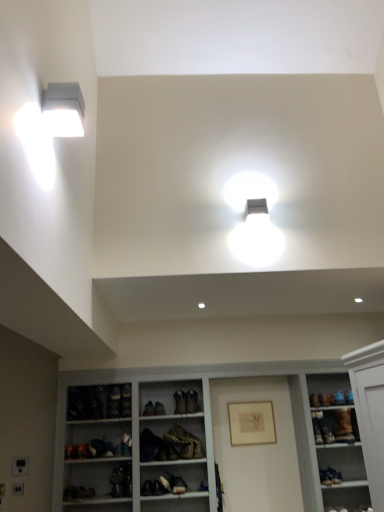
What do you see at coordinates (180, 402) in the screenshot? This screenshot has width=384, height=512. I see `matte black shoe at center, the third shoe viewed from the right` at bounding box center [180, 402].

Locate an element on the screen. leather jacket at center is located at coordinates (169, 445).

Find the location of `matte brown picture frame at center`. matte brown picture frame at center is located at coordinates (251, 423).

At what (x,y) coordinates should I click in order to perform the action: click on white matte exhaust hood at upper left. Please return your answer as a coordinate pair (x, y). Looking at the image, I should click on (42, 311).

This screenshot has height=512, width=384. What are the coordinates of `matte black shoe at center, which appears as the 2th shoe when viewed from the left` in the screenshot? It's located at (192, 402).

The height and width of the screenshot is (512, 384). Describe the element at coordinates (64, 109) in the screenshot. I see `white matte rectangular light fixture at upper left` at that location.

In order to face white matte rectangular light fixture at upper left, should I rotate leftwards or rightwards?

To align with it, rotate left about 16.422°.

Locate an element on the screen. This screenshot has width=384, height=512. matte black shoe at center, the third shoe viewed from the right is located at coordinates (180, 402).

Are matte black shoe at center, positioned as the second shoe in right-to-left order, and white wood shelves at center located far from each other?

No, there isn't a large distance between matte black shoe at center, positioned as the second shoe in right-to-left order, and white wood shelves at center.

Is matte black shoe at center, which appears as the 2th shoe when viewed from the left, at the right side of white wood shelves at center?

No.

Is white wood shelves at center a part of matte black shoe at center, positioned as the second shoe in right-to-left order?

No, white wood shelves at center is not a part of matte black shoe at center, positioned as the second shoe in right-to-left order.

Which object is more forward, matte black shoe at center, positioned as the second shoe in right-to-left order, or white wood shelves at center?

white wood shelves at center is more forward.

Is leather jacket at center to the right of matte black shoe at center, positioned as the second shoe in right-to-left order, from the viewer's perspective?

Incorrect, leather jacket at center is not on the right side of matte black shoe at center, positioned as the second shoe in right-to-left order.

Looking at this image, in terms of size, does leather jacket at center appear bigger or smaller than matte black shoe at center, positioned as the second shoe in right-to-left order?

leather jacket at center is bigger than matte black shoe at center, positioned as the second shoe in right-to-left order.

Is leather jacket at center turned away from matte black shoe at center, positioned as the second shoe in right-to-left order?

leather jacket at center is not turned away from matte black shoe at center, positioned as the second shoe in right-to-left order.

From the image's perspective, relative to matte black shoe at center, which appears as the 2th shoe when viewed from the left, is leather jacket at center above or below?

leather jacket at center is situated lower than matte black shoe at center, which appears as the 2th shoe when viewed from the left, in the image.

Which point is more distant from viewer, (335, 432) or (197, 409)?

Positioned behind is point (197, 409).

Would you consider brown suede shoe at lower right, the third shoe viewed from the left, to be distant from matte black shoe at center, which appears as the 2th shoe when viewed from the left?

Yes.

Is brown suede shoe at lower right, the third shoe viewed from the left, facing towards matte black shoe at center, which appears as the 2th shoe when viewed from the left?

No.

Between brown suede shoe at lower right, the first shoe viewed from the right, and matte black shoe at center, which appears as the 2th shoe when viewed from the left, which one has larger width?

matte black shoe at center, which appears as the 2th shoe when viewed from the left.

Which is in front, white matte rectangular light fixture at upper left or white wood shelves at center?

white matte rectangular light fixture at upper left is closer to the camera.

Between point (63, 94) and point (177, 379), which one is positioned behind?

Point (177, 379)

Identify the location of light fixture above the white wood shelves at center (from the image's perspective). Image resolution: width=384 pixels, height=512 pixels. (64, 109).

From the image's perspective, is white matte rectangular light fixture at upper left above or below white wood shelves at center?

white matte rectangular light fixture at upper left is situated higher than white wood shelves at center in the image.

Considering the sizes of leather jacket at center and brown suede shoe at lower right, the first shoe viewed from the right, in the image, is leather jacket at center wider or thinner than brown suede shoe at lower right, the first shoe viewed from the right,?

Clearly, leather jacket at center has more width compared to brown suede shoe at lower right, the first shoe viewed from the right.

Could brown suede shoe at lower right, the first shoe viewed from the right, be considered to be inside leather jacket at center?

Actually, brown suede shoe at lower right, the first shoe viewed from the right, is outside leather jacket at center.

How different are the orientations of leather jacket at center and brown suede shoe at lower right, the first shoe viewed from the right, in degrees?

0.217 degrees.

From the image's perspective, is leather jacket at center located above or below brown suede shoe at lower right, the first shoe viewed from the right?

Clearly, from the image's perspective, leather jacket at center is below brown suede shoe at lower right, the first shoe viewed from the right.

You are a GUI agent. You are given a task and a screenshot of the screen. Output one action in this format:
    pyautogui.click(x=<x>, y=<y>)
    Task: Click on the light fixture to the left of matte black shoe at center, the third shoe viewed from the right
    
    Given the screenshot: What is the action you would take?
    pyautogui.click(x=64, y=109)

What's the angular difference between white matte rectangular light fixture at upper left and matte black shoe at center, the third shoe viewed from the right,'s facing directions?

The angle between the facing direction of white matte rectangular light fixture at upper left and the facing direction of matte black shoe at center, the third shoe viewed from the right, is 81.3 degrees.

Which object is wider, white matte rectangular light fixture at upper left or matte black shoe at center, the third shoe viewed from the right?

With larger width is matte black shoe at center, the third shoe viewed from the right.

From a real-world perspective, is white matte rectangular light fixture at upper left on top of matte black shoe at center, the 1th shoe from the left?

Correct, in the physical world, white matte rectangular light fixture at upper left is higher than matte black shoe at center, the 1th shoe from the left.

Based on the photo, is matte brown picture frame at center aimed at matte black shoe at center, the 1th shoe from the left?

No, matte brown picture frame at center is not turned towards matte black shoe at center, the 1th shoe from the left.

What's the angular difference between matte brown picture frame at center and matte black shoe at center, the third shoe viewed from the right,'s facing directions?

The angle between the facing direction of matte brown picture frame at center and the facing direction of matte black shoe at center, the third shoe viewed from the right, is 7.54 degrees.

Based on the photo, is matte brown picture frame at center to the left of matte black shoe at center, the third shoe viewed from the right, from the viewer's perspective?

No, matte brown picture frame at center is not to the left of matte black shoe at center, the third shoe viewed from the right.

Is matte brown picture frame at center bigger than matte black shoe at center, the 1th shoe from the left?

No, matte brown picture frame at center is not bigger than matte black shoe at center, the 1th shoe from the left.

You are a GUI agent. You are given a task and a screenshot of the screen. Output one action in this format:
    pyautogui.click(x=<x>, y=<y>)
    Task: Click on the shoe that is the 3rd object located behind the white wood shelves at center
    This screenshot has height=512, width=384.
    Given the screenshot: What is the action you would take?
    192,402

From the image's perspective, count 2nd shoes upward from the leather jacket at center and point to it. Please provide its 2D coordinates.

[(192, 402)]

When comparing their distances from leather jacket at center, does matte brown picture frame at center or matte black shoe at center, which appears as the 2th shoe when viewed from the left, seem further?

matte brown picture frame at center lies further to leather jacket at center than the other object.

From the image, which object appears to be nearer to matte black shoe at center, the third shoe viewed from the right, leather jacket at center or white matte exhaust hood at upper left?

Based on the image, leather jacket at center appears to be nearer to matte black shoe at center, the third shoe viewed from the right.

From the image, which object appears to be nearer to white matte rectangular light fixture at upper left, white wood shelves at center or matte black shoe at center, the third shoe viewed from the right?

The object closer to white matte rectangular light fixture at upper left is white wood shelves at center.

Consider the image. When comparing their distances from leather jacket at center, does matte brown picture frame at center or white matte rectangular light fixture at upper left seem closer?

Among the two, matte brown picture frame at center is located nearer to leather jacket at center.

Considering their positions, is matte black shoe at center, the third shoe viewed from the right, positioned closer to brown suede shoe at lower right, the first shoe viewed from the right, than white matte rectangular light fixture at upper left?

matte black shoe at center, the third shoe viewed from the right, lies closer to brown suede shoe at lower right, the first shoe viewed from the right, than the other object.

From the image, which object appears to be farther from white matte exhaust hood at upper left, brown suede shoe at lower right, the third shoe viewed from the left, or matte brown picture frame at center?

brown suede shoe at lower right, the third shoe viewed from the left, is further to white matte exhaust hood at upper left.

Looking at this image, estimate the real-world distances between objects in this image. Which object is closer to white matte rectangular light fixture at upper left, white matte exhaust hood at upper left or matte brown picture frame at center?

white matte exhaust hood at upper left lies closer to white matte rectangular light fixture at upper left than the other object.

Considering their positions, is matte black shoe at center, the third shoe viewed from the right, positioned closer to white matte rectangular light fixture at upper left than white wood shelves at center?

Based on the image, white wood shelves at center appears to be nearer to white matte rectangular light fixture at upper left.

Identify the location of shelf positioned between white matte exhaust hood at upper left and matte black shoe at center, positioned as the second shoe in right-to-left order, from near to far. (199, 438).

I want to click on light fixture between white matte exhaust hood at upper left and leather jacket at center along the z-axis, so click(x=64, y=109).

Identify the location of shelf located between white matte exhaust hood at upper left and brown suede shoe at lower right, the third shoe viewed from the left, in the depth direction. This screenshot has width=384, height=512. (199, 438).

Find the location of a particular element. The image size is (384, 512). light fixture located between white matte exhaust hood at upper left and matte black shoe at center, positioned as the second shoe in right-to-left order, in the depth direction is located at coordinates (64, 109).